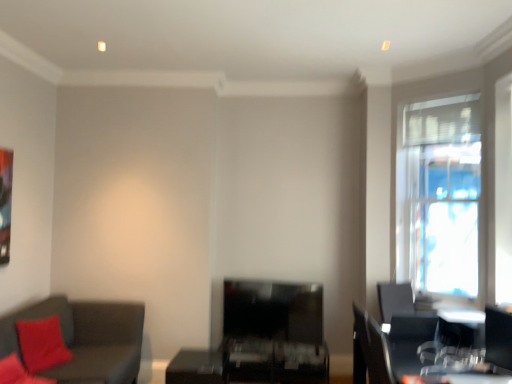
The height and width of the screenshot is (384, 512). Describe the element at coordinates (251, 363) in the screenshot. I see `matte black table at center` at that location.

Describe the element at coordinates (86, 339) in the screenshot. This screenshot has height=384, width=512. I see `dark gray fabric couch at lower left` at that location.

What do you see at coordinates (443, 189) in the screenshot?
I see `transparent glass window at right` at bounding box center [443, 189].

Find the location of `matte black table at center`. matte black table at center is located at coordinates (251, 363).

Which is less distant, (487, 341) or (306, 345)?

The point (487, 341) is closer.

How many degrees apart are the facing directions of black plastic swivel chair at lower right and matte black table at center?

78.4 degrees separate the facing orientations of black plastic swivel chair at lower right and matte black table at center.

Is black plastic swivel chair at lower right positioned with its back to matte black table at center?

No, black plastic swivel chair at lower right is not facing away from matte black table at center.

Measure the distance between black plastic swivel chair at lower right and matte black table at center.

They are 1.75 meters apart.

The height and width of the screenshot is (384, 512). I want to click on window located behind the black plastic swivel chair at lower right, so click(x=443, y=189).

Considering the positions of objects transparent glass window at right and black plastic swivel chair at lower right in the image provided, who is behind, transparent glass window at right or black plastic swivel chair at lower right?

transparent glass window at right is further away from the camera.

Which of these two, transparent glass window at right or black plastic swivel chair at lower right, stands taller?

transparent glass window at right.

Consider the image. From the image's perspective, between transparent glass window at right and black plastic swivel chair at lower right, which one is located above?

transparent glass window at right appears higher in the image.

From the image's perspective, would you say dark gray fabric couch at lower left is positioned over transparent glass window at right?

No, from the image's perspective, dark gray fabric couch at lower left is not over transparent glass window at right.

Can we say dark gray fabric couch at lower left lies outside transparent glass window at right?

dark gray fabric couch at lower left lies outside transparent glass window at right's area.

Which object is positioned more to the right, black plastic swivel chair at lower right or dark gray fabric couch at lower left?

From the viewer's perspective, black plastic swivel chair at lower right appears more on the right side.

Which object is closer to the camera, black plastic swivel chair at lower right or dark gray fabric couch at lower left?

dark gray fabric couch at lower left is more forward.

How far apart are black plastic swivel chair at lower right and dark gray fabric couch at lower left?

2.73 meters.

Looking at this image, is matte black table at center thinner than black plastic swivel chair at lower right?

No, matte black table at center is not thinner than black plastic swivel chair at lower right.

Which is more to the right, matte black table at center or black plastic swivel chair at lower right?

black plastic swivel chair at lower right is more to the right.

In the scene shown: Is there a large distance between matte black table at center and black plastic swivel chair at lower right?

Absolutely, matte black table at center is distant from black plastic swivel chair at lower right.

Could you tell me if matte black table at center is turned towards black plastic swivel chair at lower right?

No, matte black table at center is not facing towards black plastic swivel chair at lower right.

Consider the image. Which object is thinner, transparent glass window at right or matte black table at center?

transparent glass window at right is thinner.

Is transparent glass window at right oriented away from matte black table at center?

No, matte black table at center is not at the back of transparent glass window at right.

Considering the sizes of objects transparent glass window at right and matte black table at center in the image provided, who is shorter, transparent glass window at right or matte black table at center?

Standing shorter between the two is matte black table at center.

Considering their positions, is transparent glass window at right located in front of or behind matte black table at center?

Clearly, transparent glass window at right is in front of matte black table at center.

Which is nearer, [141,346] or [495,313]?

The point [495,313] is in front.

Is dark gray fabric couch at lower left oriented away from black plastic swivel chair at lower right?

No.

Is dark gray fabric couch at lower left directly adjacent to black plastic swivel chair at lower right?

There is a gap between dark gray fabric couch at lower left and black plastic swivel chair at lower right.

Based on the photo, is dark gray fabric couch at lower left positioned beyond the bounds of black plastic swivel chair at lower right?

Yes, dark gray fabric couch at lower left is outside of black plastic swivel chair at lower right.

This screenshot has height=384, width=512. Find the location of `swivel chair above the matte black table at center (from the image's perspective)`. swivel chair above the matte black table at center (from the image's perspective) is located at coordinates (x=498, y=337).

Where is `swivel chair on the left of transparent glass window at right`? The width and height of the screenshot is (512, 384). swivel chair on the left of transparent glass window at right is located at coordinates (498, 337).

From the image, which object appears to be farther from black plastic swivel chair at lower right, transparent glass window at right or matte black table at center?

Based on the image, matte black table at center appears to be further to black plastic swivel chair at lower right.

When comparing their distances from dark gray fabric couch at lower left, does matte black table at center or black plastic swivel chair at lower right seem closer?

Among the two, matte black table at center is located nearer to dark gray fabric couch at lower left.

Considering their positions, is transparent glass window at right positioned closer to dark gray fabric couch at lower left than black plastic swivel chair at lower right?

Based on the image, black plastic swivel chair at lower right appears to be nearer to dark gray fabric couch at lower left.

Which object lies nearer to the anchor point transparent glass window at right, black plastic swivel chair at lower right or matte black table at center?

Among the two, black plastic swivel chair at lower right is located nearer to transparent glass window at right.

Consider the image. Based on their spatial positions, is dark gray fabric couch at lower left or transparent glass window at right closer to black plastic swivel chair at lower right?

transparent glass window at right is closer to black plastic swivel chair at lower right.

Which object lies further to the anchor point matte black table at center, black plastic swivel chair at lower right or transparent glass window at right?

The object further to matte black table at center is transparent glass window at right.

From the image, which object appears to be farther from black plastic swivel chair at lower right, matte black table at center or dark gray fabric couch at lower left?

dark gray fabric couch at lower left lies further to black plastic swivel chair at lower right than the other object.

From the picture: Which object lies nearer to the anchor point matte black table at center, dark gray fabric couch at lower left or transparent glass window at right?

dark gray fabric couch at lower left is closer to matte black table at center.

At what (x,y) coordinates should I click in order to perform the action: click on window between black plastic swivel chair at lower right and matte black table at center in the front-back direction. Please return your answer as a coordinate pair (x, y). This screenshot has width=512, height=384. Looking at the image, I should click on (443, 189).

Identify the location of table between dark gray fabric couch at lower left and black plastic swivel chair at lower right in the horizontal direction. (251, 363).

Where is `swivel chair between dark gray fabric couch at lower left and transparent glass window at right in the horizontal direction`? Image resolution: width=512 pixels, height=384 pixels. swivel chair between dark gray fabric couch at lower left and transparent glass window at right in the horizontal direction is located at coordinates (498, 337).

What are the coordinates of `table between dark gray fabric couch at lower left and transparent glass window at right from left to right` in the screenshot? It's located at pos(251,363).